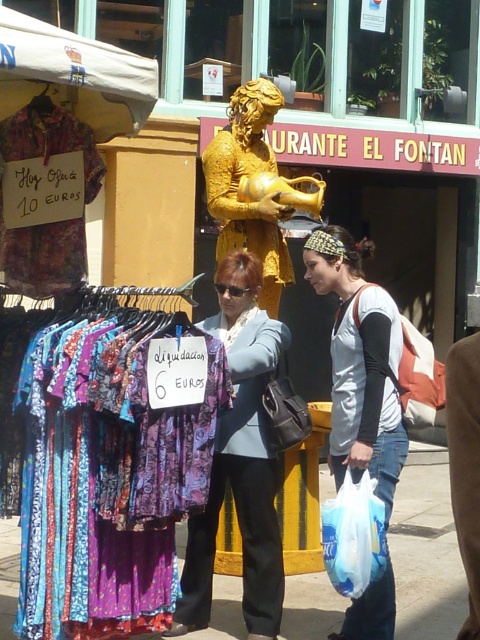
Is printed fabric dress at center further to camera compared to floral fabric dress at left?

No, it is in front of floral fabric dress at left.

Is point (108, 392) less distant than point (55, 125)?

Yes, it is in front of point (55, 125).

Image resolution: width=480 pixels, height=640 pixels. Identify the location of printed fabric dress at center. (103, 458).

The height and width of the screenshot is (640, 480). In order to click on printed fabric dress at center in this screenshot , I will do (103, 458).

Describe the element at coordinates (367, 390) in the screenshot. The width and height of the screenshot is (480, 640). I see `white cotton t-shirt at center` at that location.

Who is more distant from viewer, (x=395, y=483) or (x=327, y=563)?

Point (x=395, y=483)

Identify the location of white cotton t-shirt at center. (367, 390).

Between light blue fabric pants at center and floral fabric dress at left, which one is positioned higher?

Positioned higher is floral fabric dress at left.

At what (x,y) coordinates should I click in order to perform the action: click on light blue fabric pants at center. Please return your answer as a coordinate pair (x, y). This screenshot has height=640, width=480. Looking at the image, I should click on (240, 483).

Who is more distant from viewer, (253, 422) or (6, 259)?

The point (253, 422) is more distant.

The image size is (480, 640). Identify the location of light blue fabric pants at center. (240, 483).